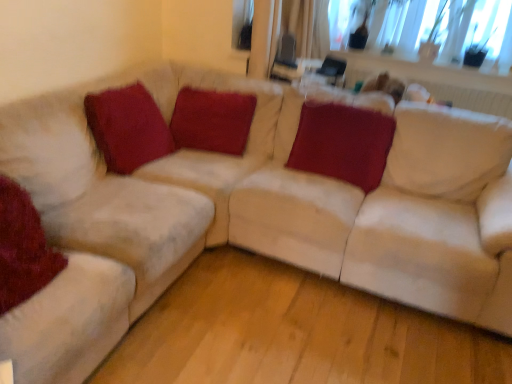
Locate an element on the screen. The width and height of the screenshot is (512, 384). velvet red pillow at lower left, acting as the 4th pillow starting from the right is located at coordinates (23, 248).

Describe the element at coordinates (343, 143) in the screenshot. I see `satin red pillow at center, which is counted as the 1th pillow, starting from the right` at that location.

Find the location of a particular element. The width and height of the screenshot is (512, 384). velvet red pillow at upper left, the 2th pillow positioned from the left is located at coordinates (127, 127).

Is velvet red pillow at center, which is counted as the 3th pillow, starting from the left, touching velvet red pillow at lower left, which is counted as the first pillow, starting from the left?

No, velvet red pillow at center, which is counted as the 3th pillow, starting from the left, is not in contact with velvet red pillow at lower left, which is counted as the first pillow, starting from the left.

Considering their positions, is velvet red pillow at center, which is counted as the 3th pillow, starting from the left, located in front of or behind velvet red pillow at lower left, acting as the 4th pillow starting from the right?

velvet red pillow at center, which is counted as the 3th pillow, starting from the left, is behind velvet red pillow at lower left, acting as the 4th pillow starting from the right.

Is velvet red pillow at center, which is the second pillow from right to left, surrounding velvet red pillow at lower left, acting as the 4th pillow starting from the right?

No, velvet red pillow at lower left, acting as the 4th pillow starting from the right, is located outside of velvet red pillow at center, which is the second pillow from right to left.

Starting from the velvet red pillow at lower left, acting as the 4th pillow starting from the right, which pillow is the 3rd one behind? Please provide its 2D coordinates.

[(212, 120)]

How different are the orientations of satin red pillow at center, which is counted as the 1th pillow, starting from the right, and velvet red pillow at center, which is counted as the 3th pillow, starting from the left, in degrees?

The angle between the facing direction of satin red pillow at center, which is counted as the 1th pillow, starting from the right, and the facing direction of velvet red pillow at center, which is counted as the 3th pillow, starting from the left, is 0.00153 degrees.

Relative to velvet red pillow at center, which is counted as the 3th pillow, starting from the left, is satin red pillow at center, which appears as the 4th pillow when viewed from the left, in front or behind?

Visually, satin red pillow at center, which appears as the 4th pillow when viewed from the left, is located in front of velvet red pillow at center, which is counted as the 3th pillow, starting from the left.

Could you tell me if satin red pillow at center, which is counted as the 1th pillow, starting from the right, is turned towards velvet red pillow at center, which is the second pillow from right to left?

No, satin red pillow at center, which is counted as the 1th pillow, starting from the right, is not facing towards velvet red pillow at center, which is the second pillow from right to left.

Can you confirm if satin red pillow at center, which is counted as the 1th pillow, starting from the right, is thinner than velvet red pillow at center, which is counted as the 3th pillow, starting from the left?

In fact, satin red pillow at center, which is counted as the 1th pillow, starting from the right, might be wider than velvet red pillow at center, which is counted as the 3th pillow, starting from the left.

Locate an element on the screen. The height and width of the screenshot is (384, 512). the 2nd pillow above the velvet red pillow at lower left, which is counted as the first pillow, starting from the left (from the image's perspective) is located at coordinates pyautogui.click(x=127, y=127).

Which object is positioned more to the right, velvet red pillow at upper left, the third pillow viewed from the right, or velvet red pillow at lower left, which is counted as the first pillow, starting from the left?

From the viewer's perspective, velvet red pillow at upper left, the third pillow viewed from the right, appears more on the right side.

How different are the orientations of velvet red pillow at upper left, the 2th pillow positioned from the left, and velvet red pillow at lower left, acting as the 4th pillow starting from the right, in degrees?

They differ by 0.00062 degrees in their facing directions.

Considering the positions of points (153, 127) and (30, 202), is point (153, 127) farther from camera compared to point (30, 202)?

Yes.

Considering the points (99, 120) and (249, 110), which point is behind, point (99, 120) or point (249, 110)?

Positioned behind is point (249, 110).

Is velvet red pillow at upper left, the 2th pillow positioned from the left, inside the boundaries of velvet red pillow at center, which is the second pillow from right to left, or outside?

velvet red pillow at upper left, the 2th pillow positioned from the left, is located beyond the bounds of velvet red pillow at center, which is the second pillow from right to left.

Does velvet red pillow at upper left, the 2th pillow positioned from the left, have a greater width compared to velvet red pillow at center, which is counted as the 3th pillow, starting from the left?

No, velvet red pillow at upper left, the 2th pillow positioned from the left, is not wider than velvet red pillow at center, which is counted as the 3th pillow, starting from the left.

Considering the sizes of objects velvet red pillow at upper left, the 2th pillow positioned from the left, and velvet red pillow at center, which is the second pillow from right to left, in the image provided, who is shorter, velvet red pillow at upper left, the 2th pillow positioned from the left, or velvet red pillow at center, which is the second pillow from right to left,?

velvet red pillow at upper left, the 2th pillow positioned from the left.

Who is smaller, velvet red pillow at lower left, acting as the 4th pillow starting from the right, or satin red pillow at center, which is counted as the 1th pillow, starting from the right?

Smaller between the two is velvet red pillow at lower left, acting as the 4th pillow starting from the right.

Is satin red pillow at center, which appears as the 4th pillow when viewed from the left, completely or partially inside velvet red pillow at lower left, acting as the 4th pillow starting from the right?

Definitely not — satin red pillow at center, which appears as the 4th pillow when viewed from the left, is not inside velvet red pillow at lower left, acting as the 4th pillow starting from the right.

Is velvet red pillow at lower left, which is counted as the first pillow, starting from the left, thinner than satin red pillow at center, which is counted as the 1th pillow, starting from the right?

Yes, velvet red pillow at lower left, which is counted as the first pillow, starting from the left, is thinner than satin red pillow at center, which is counted as the 1th pillow, starting from the right.

Does velvet red pillow at lower left, which is counted as the first pillow, starting from the left, have a larger size compared to velvet red pillow at upper left, the third pillow viewed from the right?

Indeed, velvet red pillow at lower left, which is counted as the first pillow, starting from the left, has a larger size compared to velvet red pillow at upper left, the third pillow viewed from the right.

Which object is closer to the camera taking this photo, velvet red pillow at lower left, which is counted as the first pillow, starting from the left, or velvet red pillow at upper left, the 2th pillow positioned from the left?

Positioned in front is velvet red pillow at lower left, which is counted as the first pillow, starting from the left.

Is velvet red pillow at lower left, acting as the 4th pillow starting from the right, positioned far away from velvet red pillow at upper left, the third pillow viewed from the right?

No, velvet red pillow at lower left, acting as the 4th pillow starting from the right, is in close proximity to velvet red pillow at upper left, the third pillow viewed from the right.

Does velvet red pillow at center, which is counted as the 3th pillow, starting from the left, have a greater height compared to velvet red pillow at upper left, the third pillow viewed from the right?

Correct, velvet red pillow at center, which is counted as the 3th pillow, starting from the left, is much taller as velvet red pillow at upper left, the third pillow viewed from the right.

Considering the relative positions of velvet red pillow at center, which is counted as the 3th pillow, starting from the left, and velvet red pillow at upper left, the third pillow viewed from the right, in the image provided, is velvet red pillow at center, which is counted as the 3th pillow, starting from the left, to the left of velvet red pillow at upper left, the third pillow viewed from the right, from the viewer's perspective?

In fact, velvet red pillow at center, which is counted as the 3th pillow, starting from the left, is to the right of velvet red pillow at upper left, the third pillow viewed from the right.

Does velvet red pillow at center, which is the second pillow from right to left, turn towards velvet red pillow at upper left, the 2th pillow positioned from the left?

Yes, velvet red pillow at center, which is the second pillow from right to left, is facing velvet red pillow at upper left, the 2th pillow positioned from the left.

From a real-world perspective, who is located lower, velvet red pillow at center, which is counted as the 3th pillow, starting from the left, or velvet red pillow at upper left, the third pillow viewed from the right?

velvet red pillow at center, which is counted as the 3th pillow, starting from the left, is physically lower.

Starting from the velvet red pillow at center, which is the second pillow from right to left, which pillow is the 3rd one in front? Please provide its 2D coordinates.

[(23, 248)]

From a real-world perspective, which pillow is the 2nd one underneath the satin red pillow at center, which appears as the 4th pillow when viewed from the left? Please provide its 2D coordinates.

[(212, 120)]

Consider the image. Based on their spatial positions, is velvet red pillow at center, which is counted as the 3th pillow, starting from the left, or satin red pillow at center, which is counted as the 1th pillow, starting from the right, further from velvet red pillow at lower left, acting as the 4th pillow starting from the right?

satin red pillow at center, which is counted as the 1th pillow, starting from the right, is positioned further to the anchor velvet red pillow at lower left, acting as the 4th pillow starting from the right.

When comparing their distances from satin red pillow at center, which is counted as the 1th pillow, starting from the right, does velvet red pillow at upper left, the 2th pillow positioned from the left, or velvet red pillow at center, which is the second pillow from right to left, seem closer?

The object closer to satin red pillow at center, which is counted as the 1th pillow, starting from the right, is velvet red pillow at center, which is the second pillow from right to left.

Looking at the image, which one is located further to velvet red pillow at upper left, the 2th pillow positioned from the left, velvet red pillow at lower left, acting as the 4th pillow starting from the right, or velvet red pillow at center, which is the second pillow from right to left?

Among the two, velvet red pillow at lower left, acting as the 4th pillow starting from the right, is located further to velvet red pillow at upper left, the 2th pillow positioned from the left.

Looking at this image, looking at the image, which one is located closer to velvet red pillow at center, which is counted as the 3th pillow, starting from the left, velvet red pillow at upper left, the 2th pillow positioned from the left, or satin red pillow at center, which is counted as the 1th pillow, starting from the right?

velvet red pillow at upper left, the 2th pillow positioned from the left, is closer to velvet red pillow at center, which is counted as the 3th pillow, starting from the left.

From the image, which object appears to be nearer to velvet red pillow at center, which is counted as the 3th pillow, starting from the left, satin red pillow at center, which appears as the 4th pillow when viewed from the left, or velvet red pillow at upper left, the 2th pillow positioned from the left?

velvet red pillow at upper left, the 2th pillow positioned from the left, is positioned closer to the anchor velvet red pillow at center, which is counted as the 3th pillow, starting from the left.

Considering their positions, is satin red pillow at center, which is counted as the 1th pillow, starting from the right, positioned further to velvet red pillow at upper left, the third pillow viewed from the right, than velvet red pillow at center, which is counted as the 3th pillow, starting from the left?

satin red pillow at center, which is counted as the 1th pillow, starting from the right, is positioned further to the anchor velvet red pillow at upper left, the third pillow viewed from the right.

Looking at the image, which one is located further to velvet red pillow at lower left, acting as the 4th pillow starting from the right, satin red pillow at center, which appears as the 4th pillow when viewed from the left, or velvet red pillow at center, which is counted as the 3th pillow, starting from the left?

The object further to velvet red pillow at lower left, acting as the 4th pillow starting from the right, is satin red pillow at center, which appears as the 4th pillow when viewed from the left.

Estimate the real-world distances between objects in this image. Which object is further from velvet red pillow at center, which is counted as the 3th pillow, starting from the left, satin red pillow at center, which is counted as the 1th pillow, starting from the right, or velvet red pillow at lower left, which is counted as the first pillow, starting from the left?

velvet red pillow at lower left, which is counted as the first pillow, starting from the left, lies further to velvet red pillow at center, which is counted as the 3th pillow, starting from the left, than the other object.

I want to click on pillow situated between velvet red pillow at upper left, the third pillow viewed from the right, and satin red pillow at center, which appears as the 4th pillow when viewed from the left, from left to right, so click(x=212, y=120).